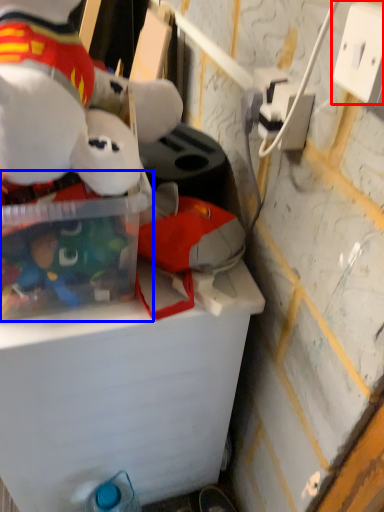
Question: Among these objects, which one is farthest to the camera, power outlet (highlighted by a red box) or storage box (highlighted by a blue box)?

Choices:
 (A) power outlet
 (B) storage box

Answer: (B)